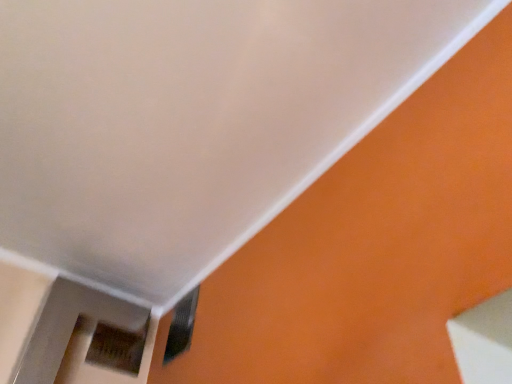
This screenshot has height=384, width=512. Find the location of `black mesh window at lower left`. black mesh window at lower left is located at coordinates (181, 326).

This screenshot has width=512, height=384. What do you see at coordinates (181, 326) in the screenshot? I see `black mesh window at lower left` at bounding box center [181, 326].

Locate an element on the screen. The height and width of the screenshot is (384, 512). black mesh window at lower left is located at coordinates (181, 326).